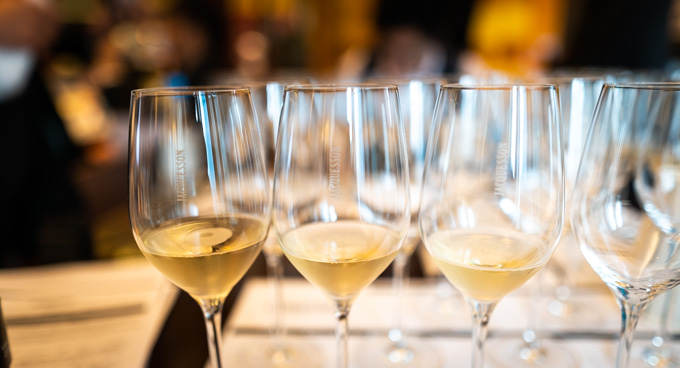
The image size is (680, 368). What are the coordinates of `wine glasses` in the screenshot? It's located at (194, 189), (311, 186), (485, 185), (624, 189), (576, 104), (421, 112), (264, 116), (660, 315), (571, 293).